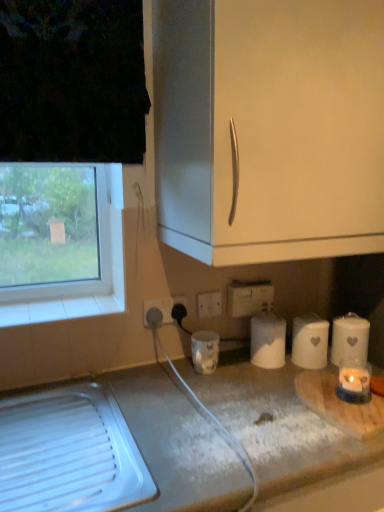
The width and height of the screenshot is (384, 512). What are the coordinates of `vacant area on top of wooden cutting board at lower right (from a real-world perspective)` in the screenshot? It's located at (340, 397).